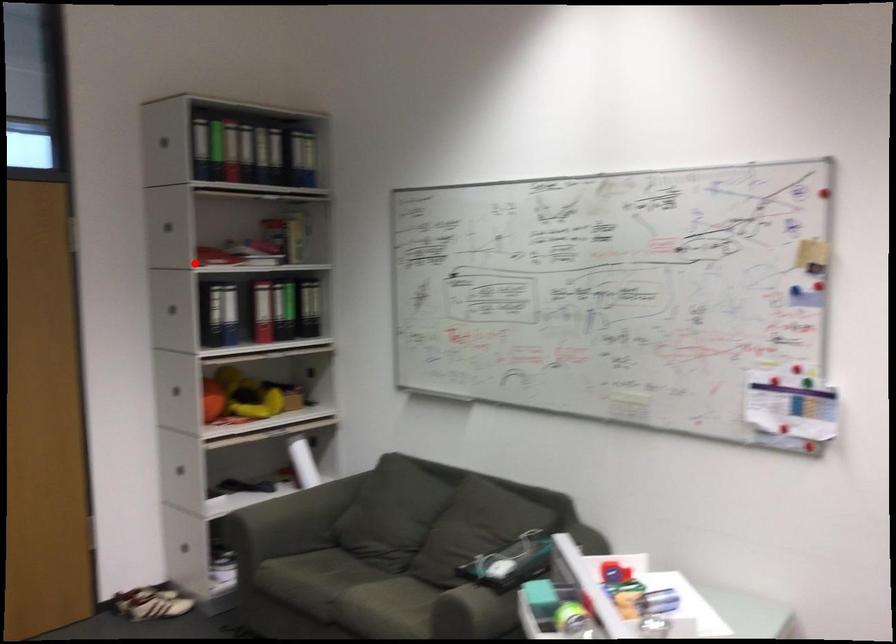
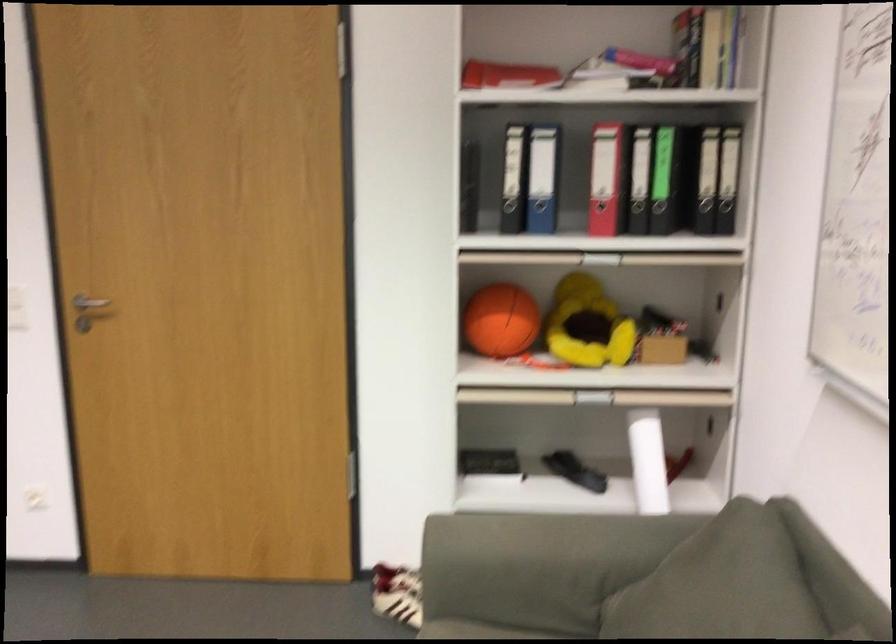
Question: I am providing you with two images of the same scene from different viewpoints. A red point is shown in image1. For the corresponding object point in image2, is it positioned nearer or farther from the camera?

Choices:
 (A) Nearer
 (B) Farther

Answer: (A)